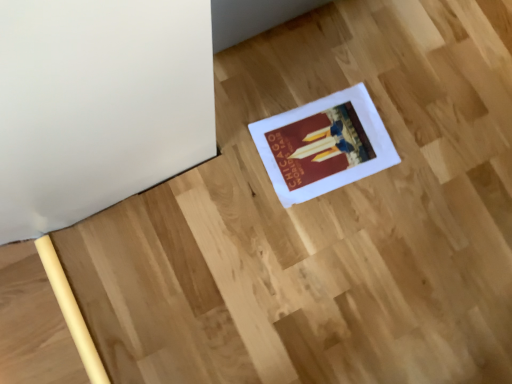
Identify the location of free point behind white matte picture frame at center. This screenshot has width=512, height=384. (355, 61).